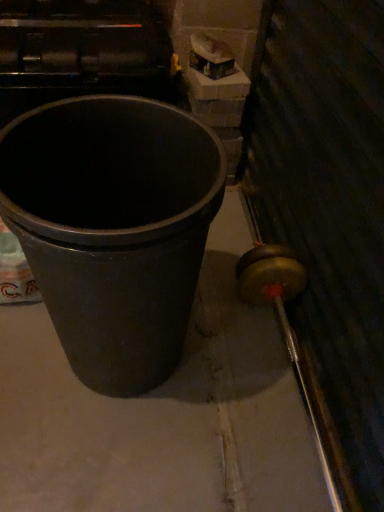
The image size is (384, 512). In order to click on free point in front of black plastic trash can at left in this screenshot , I will do `click(119, 455)`.